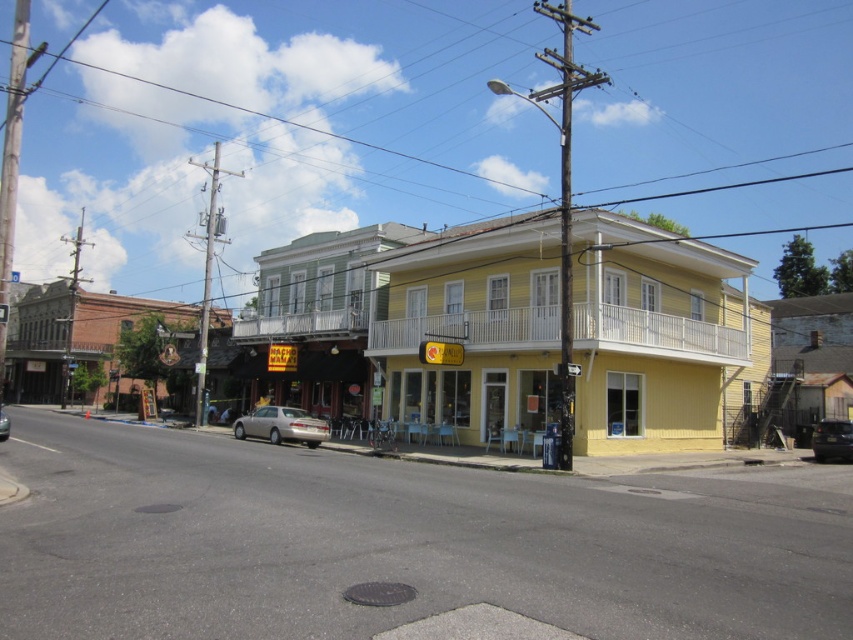
Looking at this image, you are standing at the point with coordinates (x=656, y=336) in the image. What object are you standing on?

The point at (x=656, y=336) corresponds to the yellow painted building at center.

You are a delivery person with a 2.5 meter wide truck. You need to drive through the space between the yellow painted building at center and the matte silver sedan at center. Can your truck fit through that space?

The yellow painted building at center might be wider than matte silver sedan at center, which means the space between them might be narrower than the truck width of 2.5 meters. Therefore, the truck may not fit through the space between the yellow painted building at center and the matte silver sedan at center.